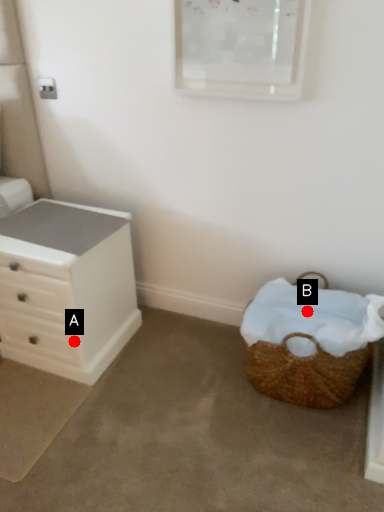
Question: Two points are circled on the image, labeled by A and B beside each circle. Which point appears farthest from the camera in this image?

Choices:
 (A) A is further
 (B) B is further

Answer: (A)